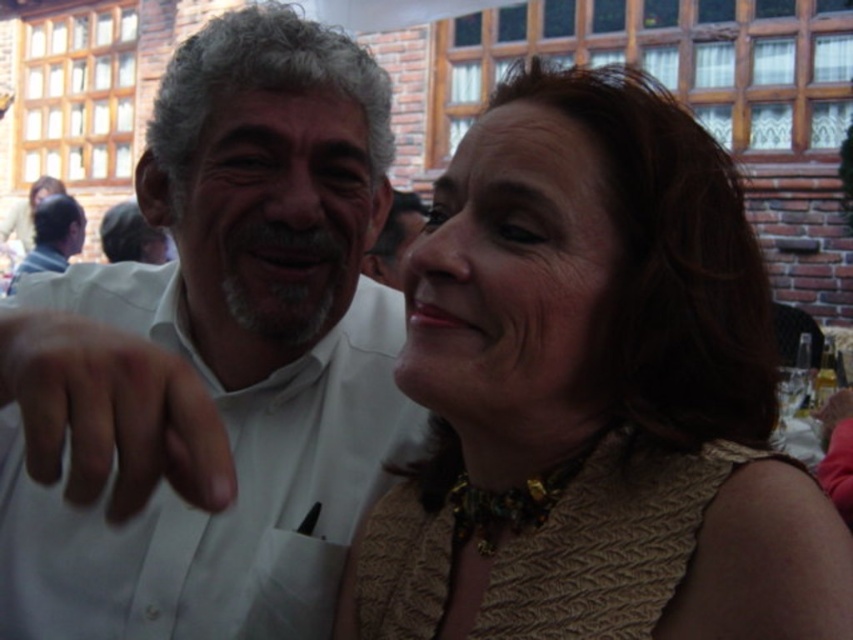
You are a photographer at a social event. You want to capture a closeup shot of the gold textured dress at center without the white matte hand at center appearing in the frame. Is the dress large enough to be photographed without including the hand?

The gold textured dress at center is bigger than the white matte hand at center, so yes, it is possible to photograph the dress without including the hand in the frame since the dress is larger in size.